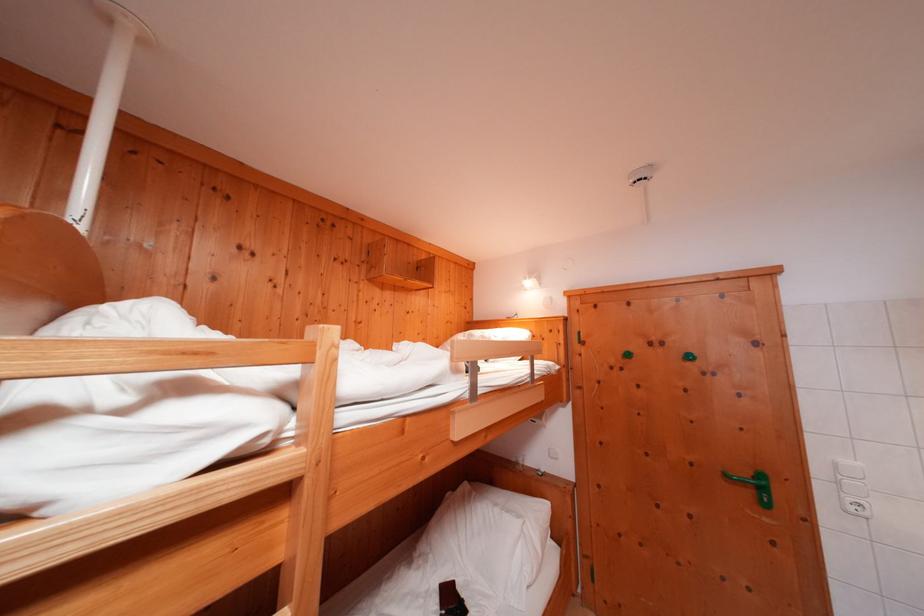
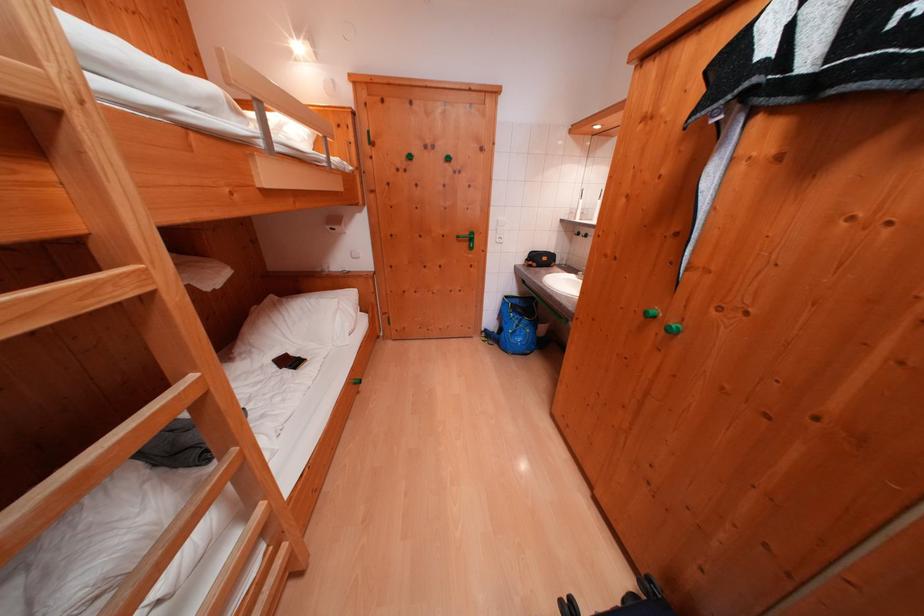
Where in the second image is the point corresponding to point 734,480 from the first image?

(466, 241)